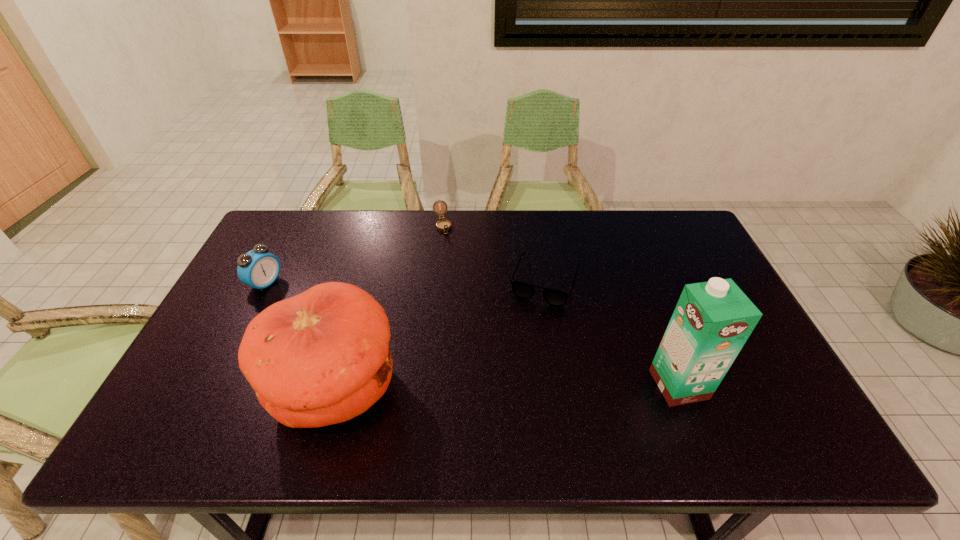
The width and height of the screenshot is (960, 540). Find the location of `vacant region located on the face of the compass`. vacant region located on the face of the compass is located at coordinates (446, 245).

I want to click on free space located on the face of the compass, so click(x=458, y=281).

You are a GUI agent. You are given a task and a screenshot of the screen. Output one action in this format:
    pyautogui.click(x=<x>, y=<y>)
    Task: Click on the vacant space located on the front-facing side of the fourth object from left to right
    
    Given the screenshot: What is the action you would take?
    pyautogui.click(x=509, y=392)

Identify the location of free space located 0.270m on the front-facing side of the fourth object from left to right. (512, 382).

I want to click on blank space located 0.240m on the front-facing side of the fourth object from left to right, so [x=515, y=372].

Locate an element on the screen. vacant space located 0.170m on the face of the alarm clock is located at coordinates (318, 310).

Find the location of `vacant region located on the face of the alarm clock`. vacant region located on the face of the alarm clock is located at coordinates (368, 334).

Where is `vacant region located on the face of the alarm clock`? The image size is (960, 540). vacant region located on the face of the alarm clock is located at coordinates (324, 313).

Identify the location of object present at the far edge. The image size is (960, 540). (444, 225).

Find the location of a particular element. The width and height of the screenshot is (960, 540). pumpkin at the near edge is located at coordinates (322, 357).